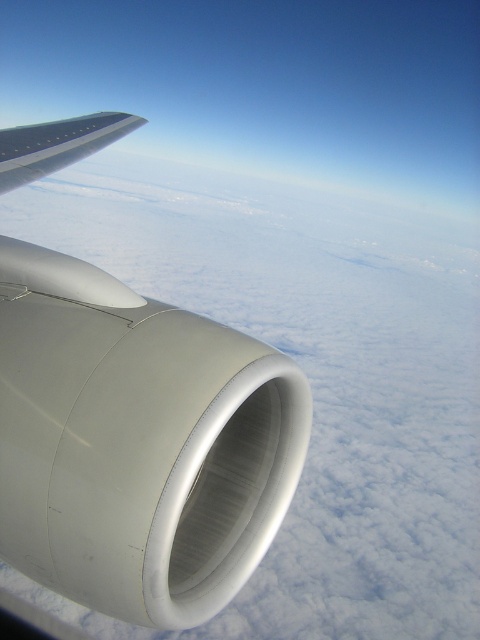
You are a flight attendant who needs to ensure that the matte white jet engine at center and the silver metallic wing at upper left are within safe operational limits. Based on their sizes, which object is wider?

The silver metallic wing at upper left is wider than the matte white jet engine at center.

You are a technician standing inside the aircraft near the window. You need to reach the matte white jet engine at center for maintenance. Given that your longest tool is 2 meters, can you safely extend your tool to the engine without overreaching?

The matte white jet engine at center is 2.53 meters away from the technician. Since the longest tool is only 2 meters, the technician cannot safely reach the engine with the available tool.

You are a flight attendant checking the aircraft components from inside the cabin. You need to determine which object is smaller between the matte white jet engine at center and the silver metallic wing at upper left. Based on your observation, which one is smaller?

The matte white jet engine at center is smaller than the silver metallic wing at upper left according to the description.